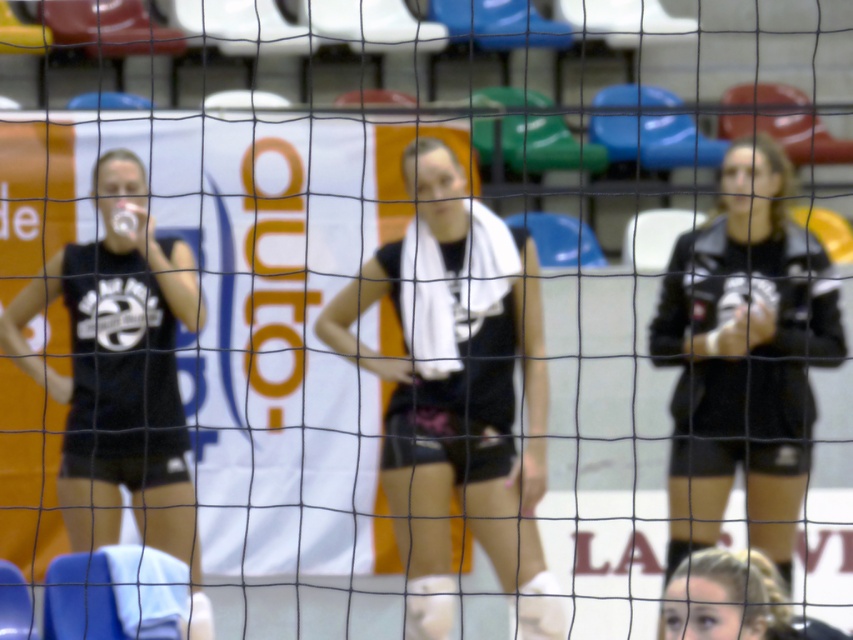
Question: Can you confirm if black matte jacket at right is bigger than black matte tank top at left?

Choices:
 (A) yes
 (B) no

Answer: (B)

Question: Is black matte tank top at center closer to camera compared to black matte jacket at right?

Choices:
 (A) no
 (B) yes

Answer: (B)

Question: Which point is closer to the camera?

Choices:
 (A) (761, 273)
 (B) (103, 163)
 (C) (432, 582)

Answer: (C)

Question: Which object is the farthest from the black matte tank top at left?

Choices:
 (A) black matte tank top at center
 (B) black matte jacket at right

Answer: (B)

Question: Considering the relative positions of black matte jacket at right and black matte tank top at left in the image provided, where is black matte jacket at right located with respect to black matte tank top at left?

Choices:
 (A) below
 (B) above

Answer: (B)

Question: Among these points, which one is farthest from the camera?

Choices:
 (A) (33, 301)
 (B) (514, 509)

Answer: (A)